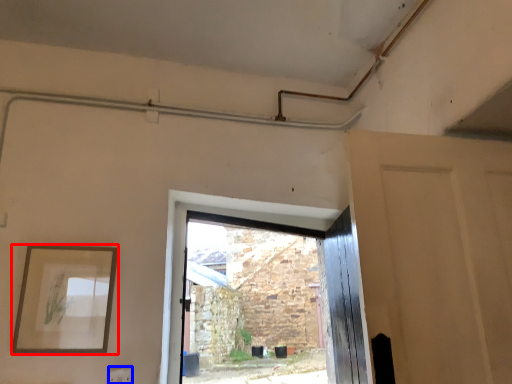
Question: Which object appears farthest to the camera in this image, picture frame (highlighted by a red box) or electric outlet (highlighted by a blue box)?

Choices:
 (A) picture frame
 (B) electric outlet

Answer: (B)